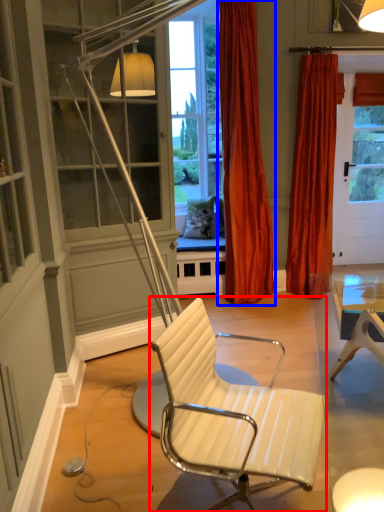
Question: Which object is further to the camera taking this photo, chair (highlighted by a red box) or curtain (highlighted by a blue box)?

Choices:
 (A) chair
 (B) curtain

Answer: (B)